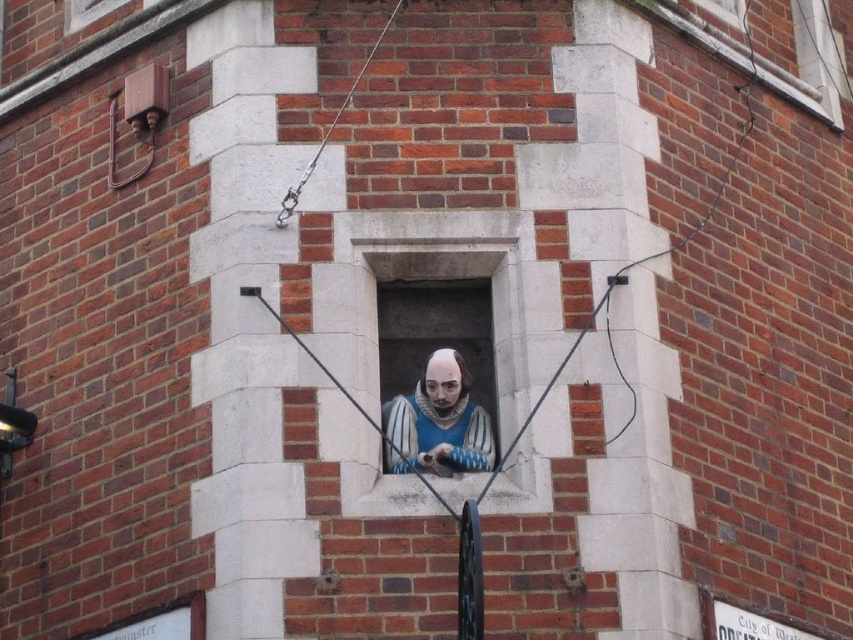
You are an architect analyzing the brick building. You need to determine which of the two white stone windows, the white stone window at upper right or the white stone window at upper center, is taller. Based on the scene description, which one is taller?

The white stone window at upper right is taller than the white stone window at upper center according to the description.

You are an architect examining a building facade. You notice two white stone windows. Which one is positioned lower on the building? The white stone window at upper right or the white stone window at upper center?

The white stone window at upper right is positioned lower on the building than the white stone window at upper center according to the description.

You are an interior designer assessing the brick building. You notice the matte blue fabric at center and the white stone window at upper center. Which object occupies a greater vertical space in the scene?

The matte blue fabric at center is taller than the white stone window at upper center, so it occupies more vertical space.